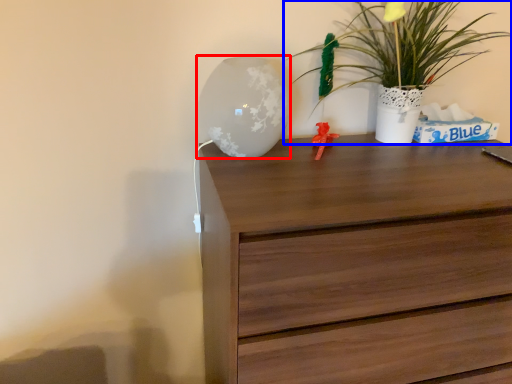
Question: Which object appears farthest to the camera in this image, table lamp (highlighted by a red box) or houseplant (highlighted by a blue box)?

Choices:
 (A) table lamp
 (B) houseplant

Answer: (B)